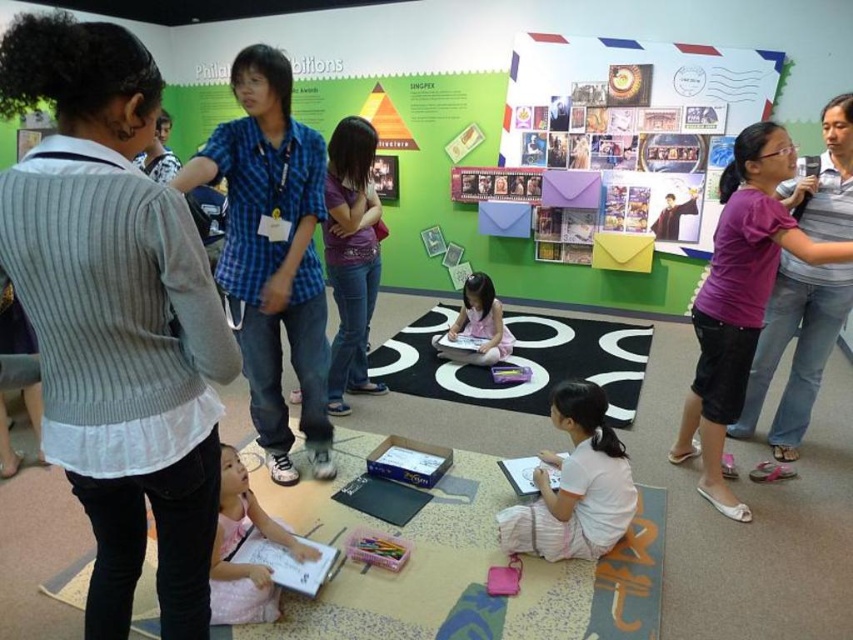
Question: Which object is farther from the camera taking this photo?

Choices:
 (A) purple cotton shirt at upper right
 (B) gray ribbed sweater at upper left

Answer: (A)

Question: Does blue plaid shirt at center appear on the left side of pink fabric dress at lower left?

Choices:
 (A) no
 (B) yes

Answer: (B)

Question: Is multicolored paper at upper right wider than pink fabric at center?

Choices:
 (A) no
 (B) yes

Answer: (B)

Question: Among these objects, which one is farthest from the camera?

Choices:
 (A) pink fabric dress at lower left
 (B) white cotton shirt at lower center
 (C) blue plaid shirt at center
 (D) pink fabric at center

Answer: (D)

Question: Considering the real-world distances, which object is farthest from the white cotton shirt at lower center?

Choices:
 (A) purple cotton shirt at upper right
 (B) pink fabric dress at lower left
 (C) pink fabric at center
 (D) gray ribbed sweater at upper left

Answer: (C)

Question: Is gray ribbed sweater at upper left bigger than blue plaid shirt at center?

Choices:
 (A) no
 (B) yes

Answer: (A)